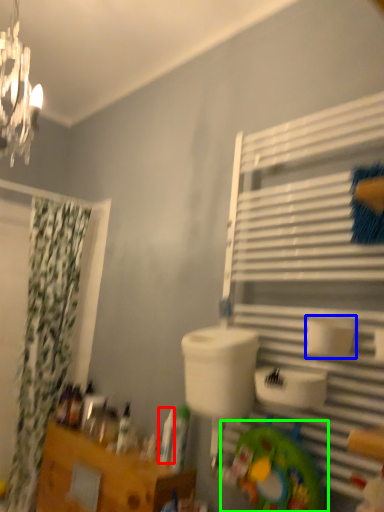
Question: Which is nearer to the toiletry (highlighted by a red box)? toilet paper (highlighted by a blue box) or toy (highlighted by a green box).

Choices:
 (A) toilet paper
 (B) toy

Answer: (B)